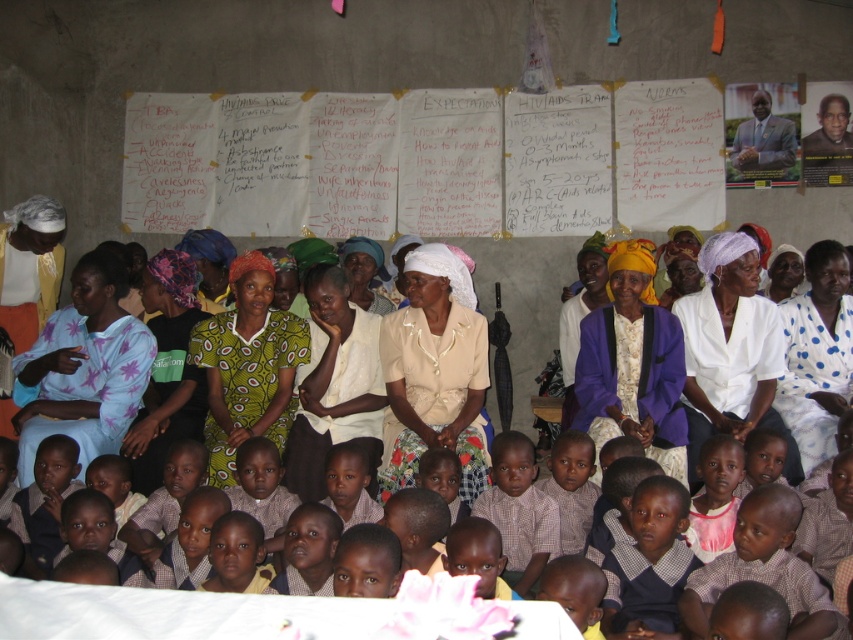
Question: Estimate the real-world distances between objects in this image. Which object is farther from the yellow fabric headscarf at center?

Choices:
 (A) matte gray suit at upper right
 (B) plaid shirt at center
 (C) matte yellow shirt at center

Answer: (A)

Question: Among these points, which one is farthest from the camera?

Choices:
 (A) (90, 403)
 (B) (704, 305)

Answer: (B)

Question: Which point is farther to the camera?

Choices:
 (A) (712, 243)
 (B) (479, 476)

Answer: (A)

Question: Can you confirm if white matte shirt at center is thinner than white dotted dress at right?

Choices:
 (A) yes
 (B) no

Answer: (B)

Question: Does white matte shirt at center have a lesser width compared to matte gray suit at upper right?

Choices:
 (A) no
 (B) yes

Answer: (A)

Question: Is matte yellow shirt at center positioned behind plaid shirt at center?

Choices:
 (A) no
 (B) yes

Answer: (B)